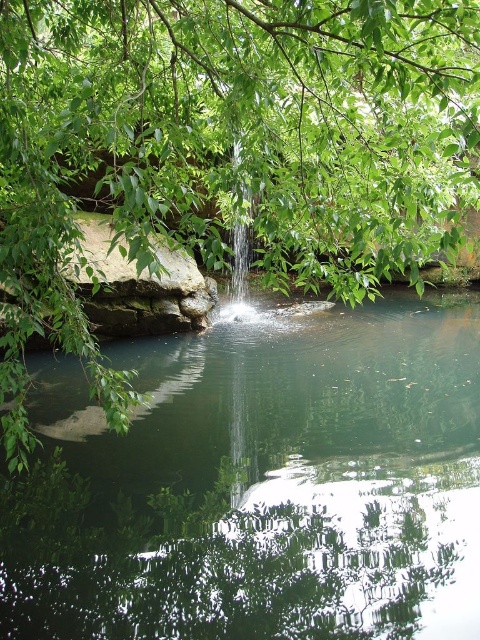
Based on the scene description, which object takes up more area in the image, the green leafy tree at upper center or the clear water at center?

The clear water at center takes up more area than the green leafy tree at upper center because the green leafy tree at upper center occupies less space than clear water at center.

You are a photographer aiming to capture the entire view of the green leafy tree at upper center and the clear water at center in a single frame. Given the spatial relationship between them, do you think you can fit both in the frame without cropping either object?

The green leafy tree at upper center has a lesser width compared to clear water at center. Since the tree is narrower than the water, you can position the camera to include both objects in the frame without cropping either, as the tree takes up less horizontal space.

You are a photographer standing in the scene and want to capture a photo of both the green liquid at center and the green leafy tree at upper center. Which object should you adjust your camera to focus on first if you want to include both in the frame?

You should focus on the green leafy tree at upper center first because it is located to the left of the green liquid at center, allowing you to frame both objects by adjusting the camera to the left.